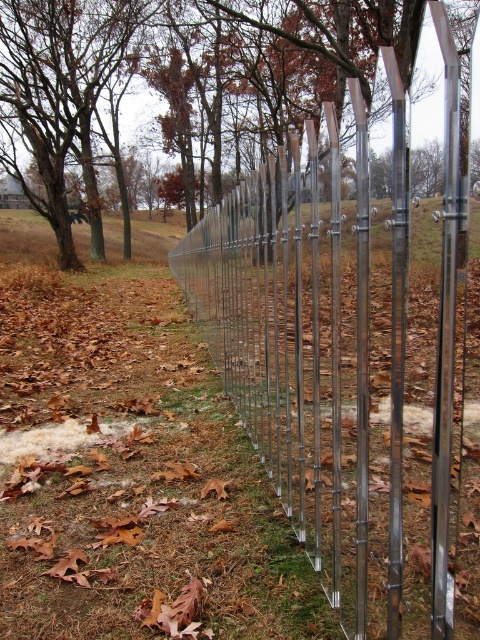
You are standing at the point marked as point (356,342) in the image. What object is located exactly at this point?

The metallic silver fence at center is located exactly at point (356,342).

You are standing at the starting point of the fence and want to walk towards the end. You see two points marked on the ground, point 1 at point (340, 20) and point 2 at point (437, 625). Which point will you reach first as you walk along the fence?

Point 1 at point (340, 20) is closer to you, so you will reach point 1 at point (340, 20) first.